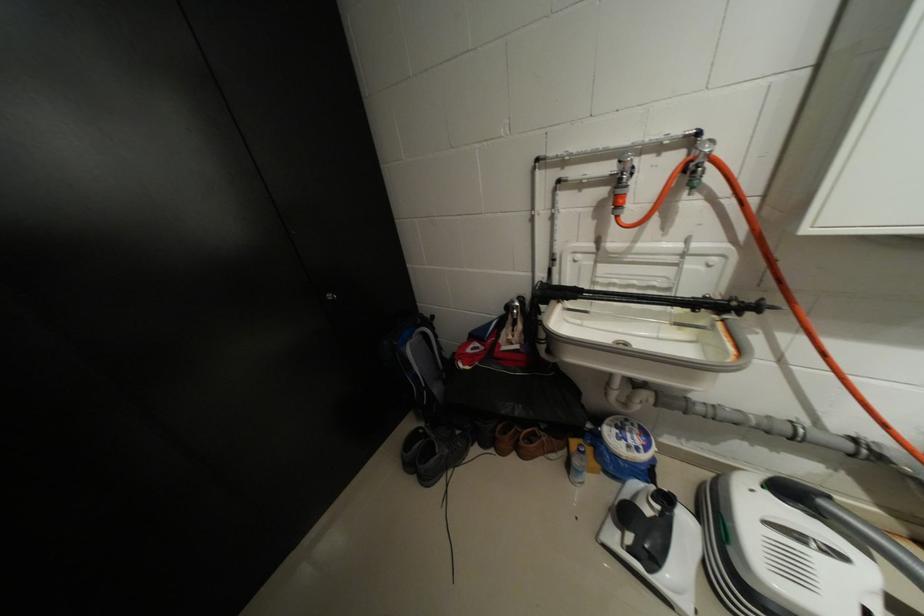
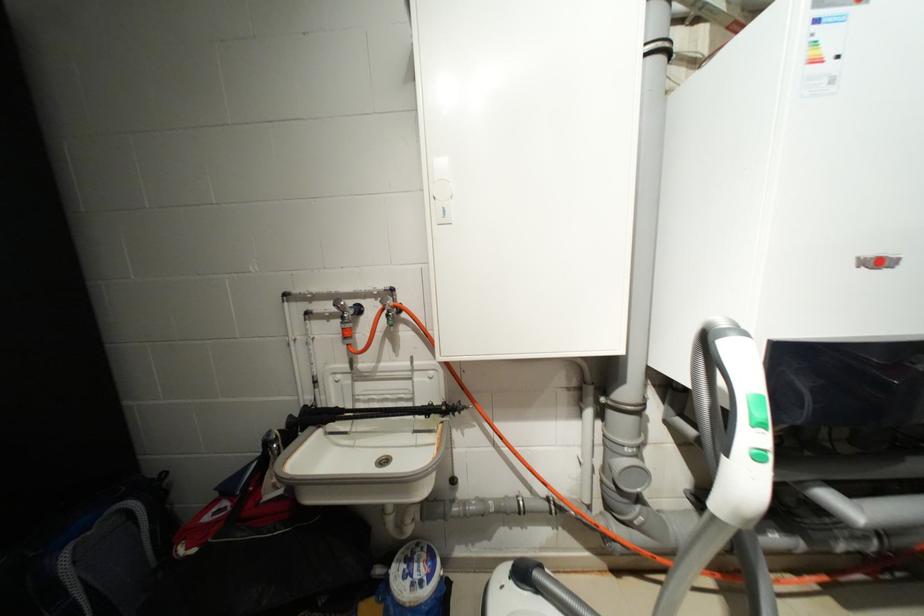
From the picture: First-person continuous shooting, in which direction is the camera rotating?

The camera rotated toward right-up.